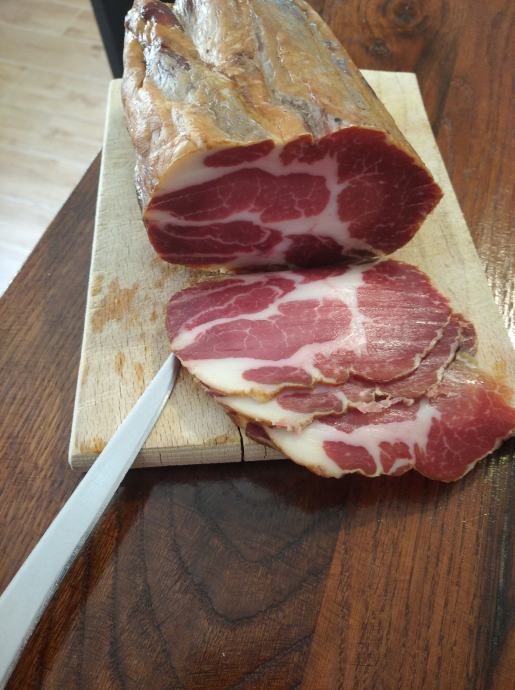
At what (x,y) coordinates should I click in order to perform the action: click on floor. Please return your answer as a coordinate pair (x, y). The width and height of the screenshot is (515, 690). Looking at the image, I should click on (65, 61).